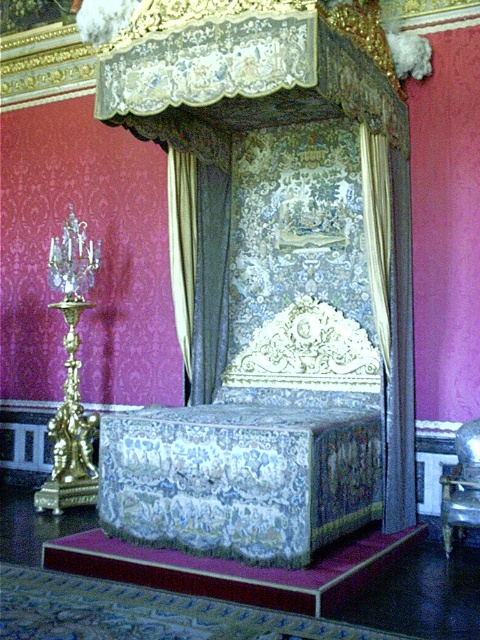
Question: Does silky blue fabric bed at center appear on the right side of metallic silver bed at center?

Choices:
 (A) yes
 (B) no

Answer: (B)

Question: Based on their relative distances, which object is nearer to the silky brocade bed frame at center?

Choices:
 (A) silky blue fabric bed at center
 (B) metallic silver bed at center
 (C) silky white curtain at right
 (D) silky gold curtain at center

Answer: (A)

Question: Does silky gold curtain at center appear on the left side of silky beige curtain at center?

Choices:
 (A) no
 (B) yes

Answer: (A)

Question: Which point is farther to the camera?

Choices:
 (A) silky blue fabric bed at center
 (B) silky white curtain at right
 (C) metallic silver bed at center
 (D) silky gold curtain at center

Answer: (D)

Question: Which object appears farthest from the camera in this image?

Choices:
 (A) silky white curtain at right
 (B) silky beige curtain at center
 (C) silky blue fabric bed at center
 (D) metallic silver bed at center

Answer: (B)

Question: Is silky gold curtain at center behind silky beige curtain at center?

Choices:
 (A) no
 (B) yes

Answer: (B)